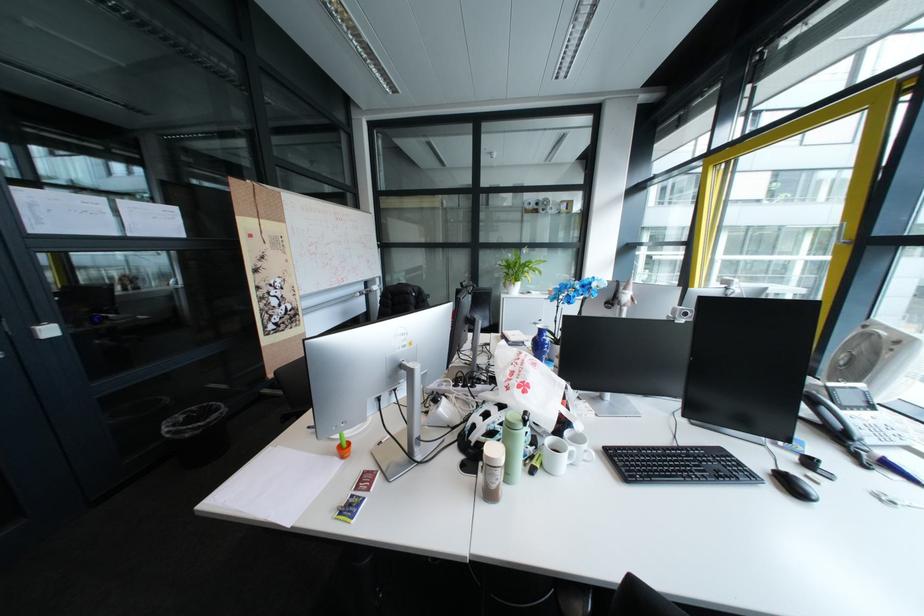
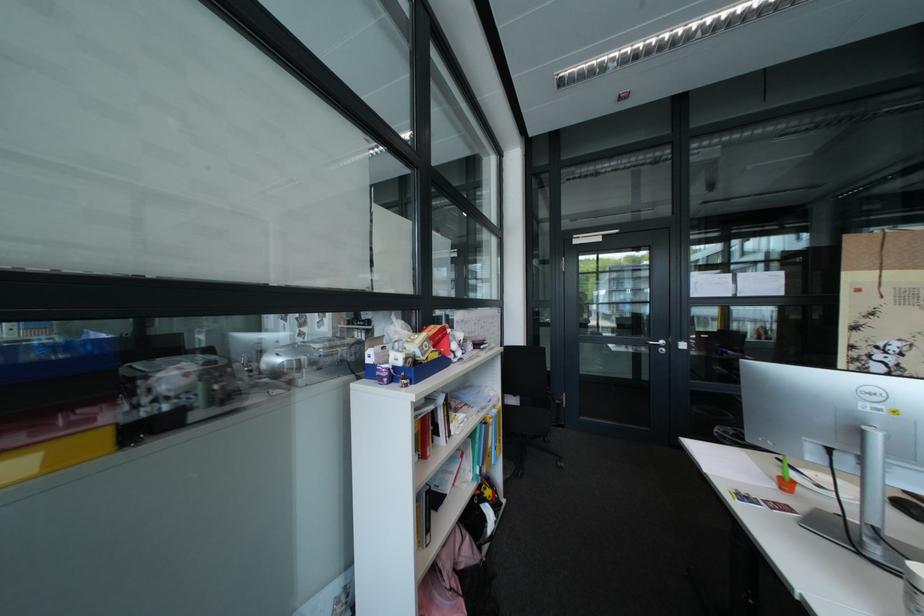
Question: The camera is either moving clockwise (left) or counter-clockwise (right) around the object. The first image is from the beginning of the video and the second image is from the end. Is the camera moving left or right when shooting the video?

Choices:
 (A) Left
 (B) Right

Answer: (B)